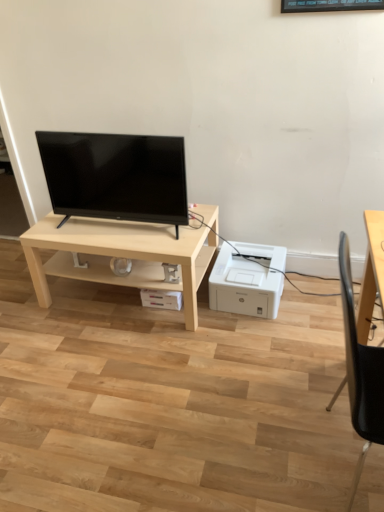
This screenshot has height=512, width=384. What do you see at coordinates (244, 286) in the screenshot?
I see `white plastic printer at lower right` at bounding box center [244, 286].

Where is `white plastic printer at lower right`? This screenshot has height=512, width=384. white plastic printer at lower right is located at coordinates (244, 286).

Based on their sizes in the image, would you say black glossy tv at center is bigger or smaller than white plastic printer at lower right?

Considering their sizes, black glossy tv at center takes up more space than white plastic printer at lower right.

Is black glossy tv at center positioned in front of white plastic printer at lower right?

Yes, black glossy tv at center is closer to the camera.

Can you confirm if black glossy tv at center is wider than white plastic printer at lower right?

No, black glossy tv at center is not wider than white plastic printer at lower right.

Does black glossy tv at center turn towards white plastic printer at lower right?

No, black glossy tv at center is not aimed at white plastic printer at lower right.

Can you confirm if black plastic chair at right is smaller than light wood table at center?

Indeed, black plastic chair at right has a smaller size compared to light wood table at center.

Considering the sizes of objects black plastic chair at right and light wood table at center in the image provided, who is taller, black plastic chair at right or light wood table at center?

Standing taller between the two is black plastic chair at right.

Which is closer, (350, 291) or (64, 268)?

The point (350, 291) is more forward.

Based on the photo, in terms of height, does white plastic printer at lower right look taller or shorter compared to black glossy tv at center?

Considering their sizes, white plastic printer at lower right has less height than black glossy tv at center.

Looking at this image, how much distance is there between white plastic printer at lower right and black glossy tv at center?

white plastic printer at lower right and black glossy tv at center are 23.76 inches apart from each other.

From the image's perspective, which is above, white plastic printer at lower right or black glossy tv at center?

From the image's view, black glossy tv at center is above.

Can you tell me how much white plastic printer at lower right and black glossy tv at center differ in facing direction?

They differ by 2.61 degrees in their facing directions.

Is white plastic printer at lower right facing away from light wood table at center?

No.

From the image's perspective, is white plastic printer at lower right on light wood table at center?

Incorrect, from the image's perspective, white plastic printer at lower right is lower than light wood table at center.

Where is `printer directly beneath the light wood table at center (from a real-world perspective)`? printer directly beneath the light wood table at center (from a real-world perspective) is located at coordinates (244, 286).

Is light wood table at center behind black glossy tv at center?

Yes.

Between light wood table at center and black glossy tv at center, which one has more height?

With more height is black glossy tv at center.

Can you confirm if light wood table at center is smaller than black glossy tv at center?

No.

From the image's perspective, between light wood table at center and black glossy tv at center, which one is located above?

black glossy tv at center appears higher in the image.

From a real-world perspective, is black glossy tv at center positioned under light wood table at center based on gravity?

Actually, black glossy tv at center is physically above light wood table at center in the real world.

Which is behind, black glossy tv at center or light wood table at center?

light wood table at center is further away from the camera.

Does black glossy tv at center appear on the right side of light wood table at center?

No.

Between point (139, 158) and point (101, 282), which one is positioned behind?

Positioned behind is point (101, 282).

Which object is more forward, black plastic chair at right or black glossy tv at center?

black plastic chair at right.

How many degrees apart are the facing directions of black plastic chair at right and black glossy tv at center?

The angular difference between black plastic chair at right and black glossy tv at center is 90.4 degrees.

This screenshot has width=384, height=512. What are the coordinates of `chair below the black glossy tv at center (from the image's perspective)` in the screenshot? It's located at (360, 372).

Which of these two, black plastic chair at right or black glossy tv at center, is smaller?

Smaller between the two is black glossy tv at center.

At what (x,y) coordinates should I click in order to perform the action: click on television that is above the white plastic printer at lower right (from a real-world perspective). Please return your answer as a coordinate pair (x, y). Looking at the image, I should click on (116, 176).

Where is `table that is above the black plastic chair at right (from the image's perspective)`? table that is above the black plastic chair at right (from the image's perspective) is located at coordinates (119, 255).

Based on their spatial positions, is black plastic chair at right or light wood table at center closer to black glossy tv at center?

Based on the image, light wood table at center appears to be nearer to black glossy tv at center.

Estimate the real-world distances between objects in this image. Which object is closer to black glossy tv at center, light wood table at center or white plastic printer at lower right?

light wood table at center.

Based on their spatial positions, is black plastic chair at right or black glossy tv at center further from light wood table at center?

A: black plastic chair at right.

When comparing their distances from black plastic chair at right, does white plastic printer at lower right or black glossy tv at center seem closer?

Among the two, white plastic printer at lower right is located nearer to black plastic chair at right.

Looking at the image, which one is located closer to light wood table at center, black glossy tv at center or black plastic chair at right?

Among the two, black glossy tv at center is located nearer to light wood table at center.

Looking at the image, which one is located further to light wood table at center, black plastic chair at right or white plastic printer at lower right?

black plastic chair at right is further to light wood table at center.

From the image, which object appears to be farther from black plastic chair at right, light wood table at center or black glossy tv at center?

black glossy tv at center lies further to black plastic chair at right than the other object.

When comparing their distances from black plastic chair at right, does white plastic printer at lower right or light wood table at center seem closer?

Among the two, white plastic printer at lower right is located nearer to black plastic chair at right.

I want to click on television positioned between black plastic chair at right and white plastic printer at lower right from near to far, so click(116, 176).

Where is `table between black glossy tv at center and white plastic printer at lower right`? table between black glossy tv at center and white plastic printer at lower right is located at coordinates point(119,255).

Locate an element on the screen. television located between black plastic chair at right and light wood table at center in the depth direction is located at coordinates [116, 176].

Find the location of a particular element. table between black plastic chair at right and white plastic printer at lower right from front to back is located at coordinates (119, 255).